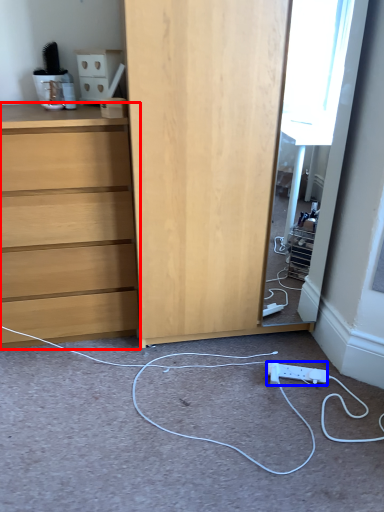
Question: Which of the following is the farthest to the observer, chest of drawers (highlighted by a red box) or electric outlet (highlighted by a blue box)?

Choices:
 (A) chest of drawers
 (B) electric outlet

Answer: (B)